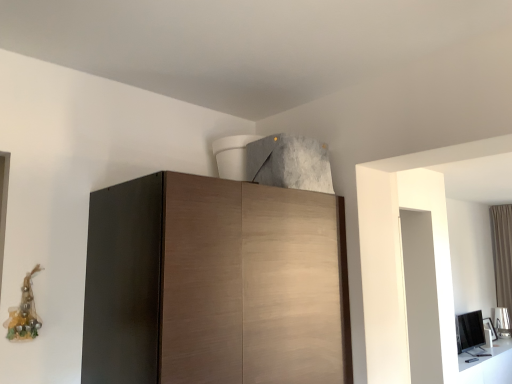
Question: From a real-world perspective, is wooden cabinet at center positioned over brown fabric curtain at right based on gravity?

Choices:
 (A) yes
 (B) no

Answer: (A)

Question: Considering the relative sizes of wooden cabinet at center and brown fabric curtain at right in the image provided, is wooden cabinet at center wider than brown fabric curtain at right?

Choices:
 (A) yes
 (B) no

Answer: (A)

Question: Is wooden cabinet at center at the right side of brown fabric curtain at right?

Choices:
 (A) no
 (B) yes

Answer: (A)

Question: Could brown fabric curtain at right be considered to be inside wooden cabinet at center?

Choices:
 (A) yes
 (B) no

Answer: (B)

Question: Is wooden cabinet at center facing towards brown fabric curtain at right?

Choices:
 (A) no
 (B) yes

Answer: (A)

Question: Considering the relative sizes of wooden cabinet at center and brown fabric curtain at right in the image provided, is wooden cabinet at center bigger than brown fabric curtain at right?

Choices:
 (A) yes
 (B) no

Answer: (A)

Question: Is brown fabric curtain at right next to wooden cabinet at center?

Choices:
 (A) yes
 (B) no

Answer: (B)

Question: Is brown fabric curtain at right positioned behind wooden cabinet at center?

Choices:
 (A) yes
 (B) no

Answer: (A)

Question: Is brown fabric curtain at right oriented away from wooden cabinet at center?

Choices:
 (A) yes
 (B) no

Answer: (B)

Question: Does brown fabric curtain at right have a lesser width compared to wooden cabinet at center?

Choices:
 (A) no
 (B) yes

Answer: (B)

Question: Is brown fabric curtain at right taller than wooden cabinet at center?

Choices:
 (A) yes
 (B) no

Answer: (A)

Question: From the image's perspective, is brown fabric curtain at right over wooden cabinet at center?

Choices:
 (A) yes
 (B) no

Answer: (B)

Question: Considering their positions, is wooden cabinet at center located in front of or behind brown fabric curtain at right?

Choices:
 (A) behind
 (B) front

Answer: (B)